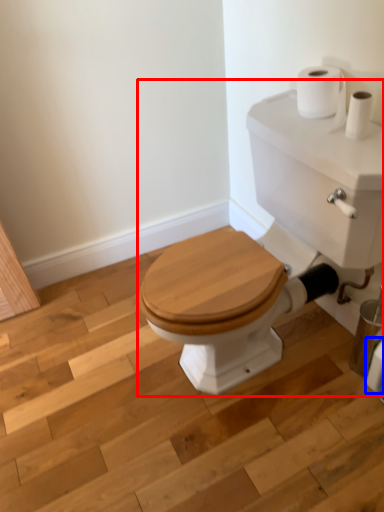
Question: Which object is closer to the camera taking this photo, porcelain (highlighted by a red box) or toilet paper (highlighted by a blue box)?

Choices:
 (A) porcelain
 (B) toilet paper

Answer: (A)